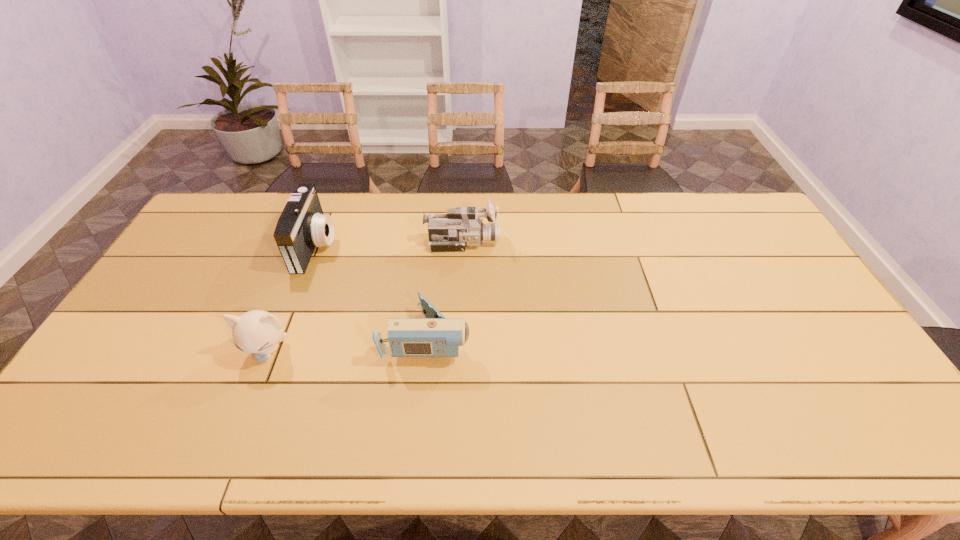
The image size is (960, 540). What are the coordinates of `the leftmost camcorder` in the screenshot? It's located at click(x=302, y=226).

Where is `kitten`? kitten is located at coordinates (257, 331).

Where is `the nearest camcorder`? The width and height of the screenshot is (960, 540). the nearest camcorder is located at coordinates (434, 336).

This screenshot has width=960, height=540. In order to click on free region located on the lens of the leftmost camcorder in this screenshot , I will do `click(436, 245)`.

Image resolution: width=960 pixels, height=540 pixels. What are the coordinates of `blank area located 0.220m on the face of the kitten` in the screenshot? It's located at (227, 453).

This screenshot has width=960, height=540. I want to click on blank area located 0.130m on the side of the shortest camcorder with the flip-out screen, so click(x=517, y=336).

The width and height of the screenshot is (960, 540). In the image, there is a desktop. Find the location of `vacant space at the far edge`. vacant space at the far edge is located at coordinates (634, 226).

Image resolution: width=960 pixels, height=540 pixels. What are the coordinates of `free space at the left edge of the desktop` in the screenshot? It's located at (97, 396).

At what (x,y) coordinates should I click in order to perform the action: click on vacant space at the right edge of the desktop. Please return your answer as a coordinate pair (x, y). Looking at the image, I should click on (745, 258).

In the image, there is a desktop. Identify the location of vacant space at the far left corner. Image resolution: width=960 pixels, height=540 pixels. (245, 203).